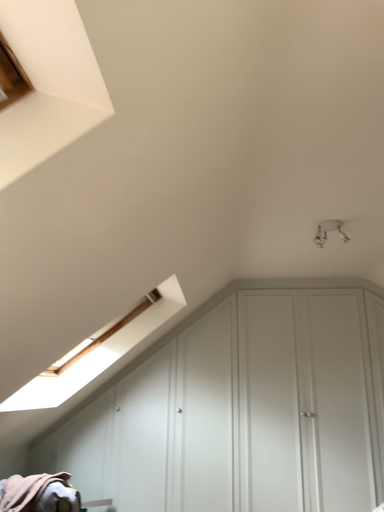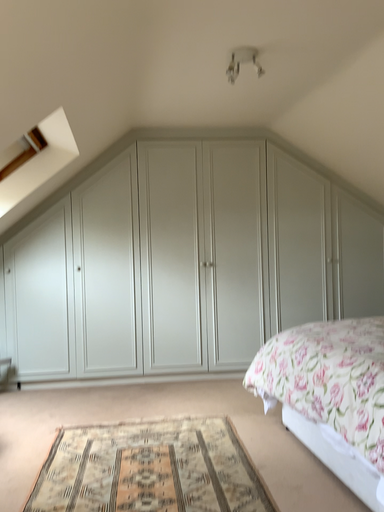
Question: How did the camera likely rotate when shooting the video?

Choices:
 (A) rotated right
 (B) rotated left

Answer: (A)